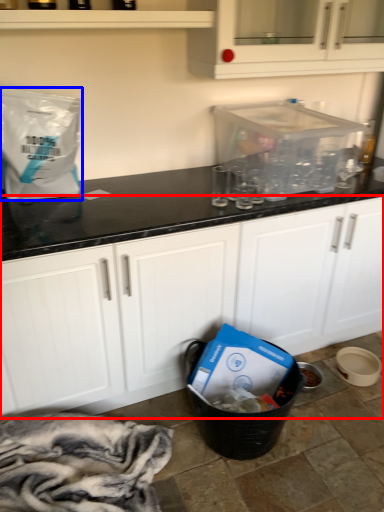
Question: Which object is closer to the camera taking this photo, cabinetry (highlighted by a red box) or paper bag (highlighted by a blue box)?

Choices:
 (A) cabinetry
 (B) paper bag

Answer: (A)